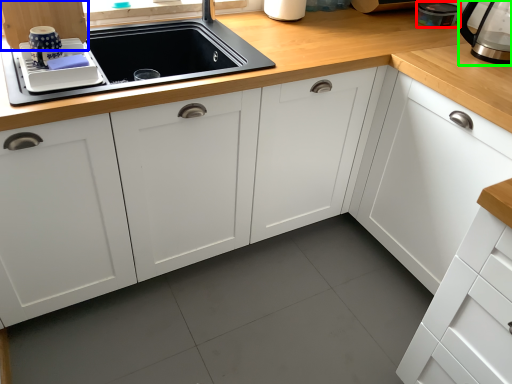
Question: Estimate the real-world distances between objects in this image. Which object is closer to appliance (highlighted by a red box), cabinetry (highlighted by a blue box) or coffeepot (highlighted by a green box)?

Choices:
 (A) cabinetry
 (B) coffeepot

Answer: (B)